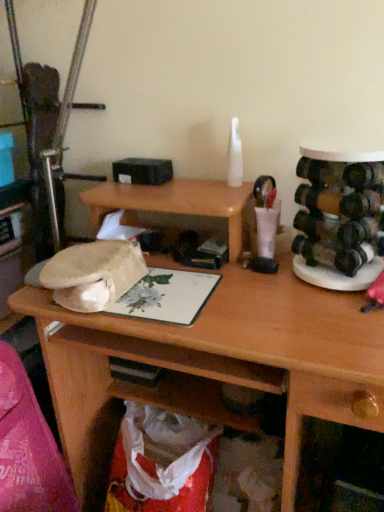
What do you see at coordinates (217, 362) in the screenshot?
I see `wooden desk at center` at bounding box center [217, 362].

Find the location of a particular element. wooden desk at center is located at coordinates (217, 362).

Image resolution: width=384 pixels, height=512 pixels. In order to click on wooden desk at center in this screenshot , I will do `click(217, 362)`.